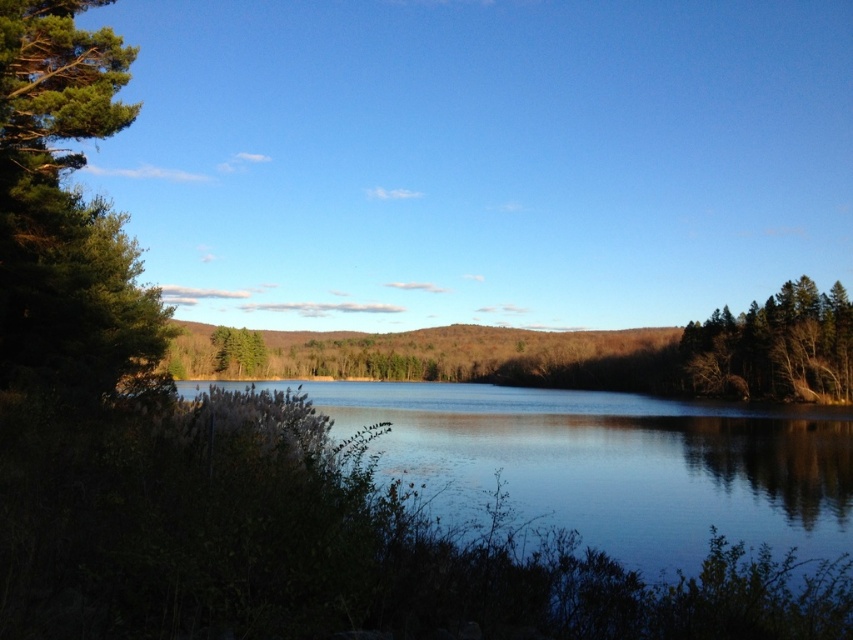
Question: Which object appears farthest from the camera in this image?

Choices:
 (A) green matte tree at center
 (B) clear water at center

Answer: (A)

Question: Can you confirm if green matte tree at right is positioned above green matte tree at center?

Choices:
 (A) no
 (B) yes

Answer: (A)

Question: Which object is positioned closest to the clear water at center?

Choices:
 (A) green matte tree at center
 (B) green matte tree at right

Answer: (B)

Question: Does clear water at center have a smaller size compared to green matte tree at right?

Choices:
 (A) yes
 (B) no

Answer: (B)

Question: Which point appears farthest from the camera in this image?

Choices:
 (A) (236, 339)
 (B) (701, 464)
 (C) (683, 349)

Answer: (C)

Question: Is clear water at center bigger than green matte tree at center?

Choices:
 (A) no
 (B) yes

Answer: (B)